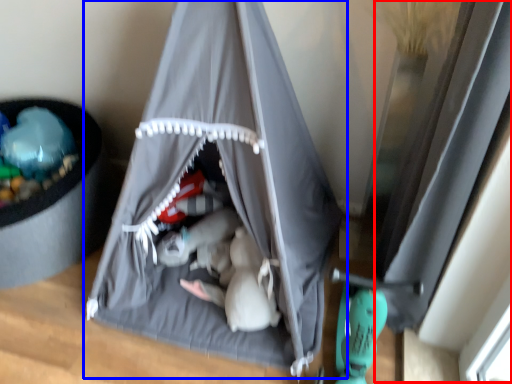
Question: Which object appears farthest to the camera in this image, window (highlighted by a red box) or tent (highlighted by a blue box)?

Choices:
 (A) window
 (B) tent

Answer: (A)